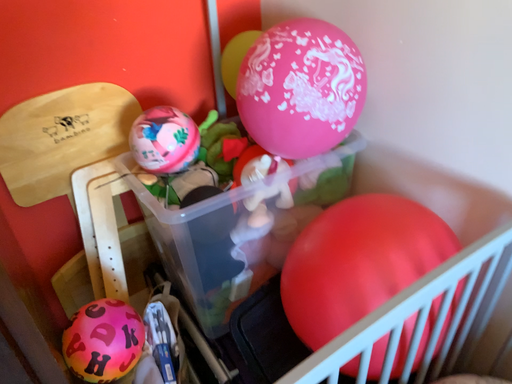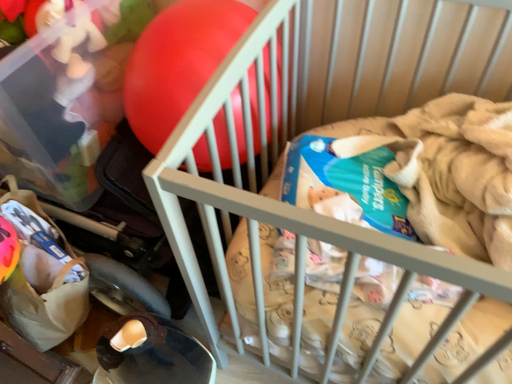
Question: How did the camera likely rotate when shooting the video?

Choices:
 (A) rotated downward
 (B) rotated upward

Answer: (A)